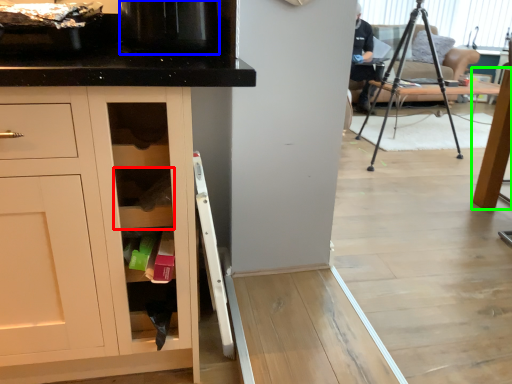
Question: Which object is positioned farthest from shelf (highlighted by a red box)? Select from appliance (highlighted by a blue box) and table (highlighted by a green box).

Choices:
 (A) appliance
 (B) table

Answer: (B)